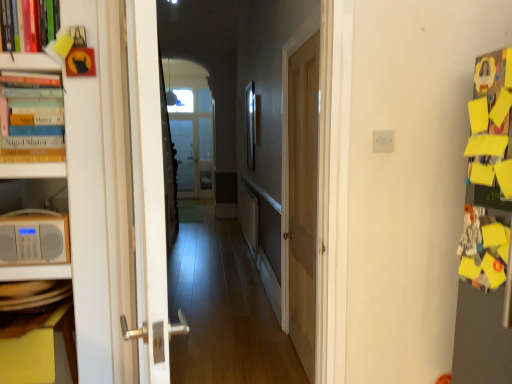
Question: Is hardcover books at left inside white plastic electric outlet at center?

Choices:
 (A) no
 (B) yes

Answer: (A)

Question: Considering the relative sizes of white plastic electric outlet at center and hardcover books at left in the image provided, is white plastic electric outlet at center wider than hardcover books at left?

Choices:
 (A) yes
 (B) no

Answer: (B)

Question: Would you consider white plastic electric outlet at center to be distant from hardcover books at left?

Choices:
 (A) no
 (B) yes

Answer: (B)

Question: Is white plastic electric outlet at center located outside hardcover books at left?

Choices:
 (A) yes
 (B) no

Answer: (A)

Question: Is white plastic electric outlet at center looking in the opposite direction of hardcover books at left?

Choices:
 (A) no
 (B) yes

Answer: (A)

Question: From a real-world perspective, is metallic silver picture frame at center above or below matte white radio at left?

Choices:
 (A) above
 (B) below

Answer: (A)

Question: In the image, is metallic silver picture frame at center positioned in front of or behind matte white radio at left?

Choices:
 (A) front
 (B) behind

Answer: (B)

Question: Looking at the image, does metallic silver picture frame at center seem bigger or smaller compared to matte white radio at left?

Choices:
 (A) big
 (B) small

Answer: (A)

Question: Is metallic silver picture frame at center taller or shorter than matte white radio at left?

Choices:
 (A) tall
 (B) short

Answer: (A)

Question: From a real-world perspective, relative to matte white radio at left, is white glossy door at left, the 1th door from the left, vertically above or below?

Choices:
 (A) above
 (B) below

Answer: (A)

Question: In terms of height, does white glossy door at left, marked as the second door in a right-to-left arrangement, look taller or shorter compared to matte white radio at left?

Choices:
 (A) tall
 (B) short

Answer: (A)

Question: Relative to matte white radio at left, is white glossy door at left, acting as the 1th door starting from the front, in front or behind?

Choices:
 (A) behind
 (B) front

Answer: (B)

Question: Considering the positions of white glossy door at left, acting as the 1th door starting from the front, and matte white radio at left in the image, is white glossy door at left, acting as the 1th door starting from the front, wider or thinner than matte white radio at left?

Choices:
 (A) wide
 (B) thin

Answer: (A)

Question: From the image's perspective, relative to wooden door at center, the second door positioned from the left, is wooden floor at center above or below?

Choices:
 (A) below
 (B) above

Answer: (B)

Question: From a real-world perspective, is wooden floor at center positioned above or below wooden door at center, the second door positioned from the left?

Choices:
 (A) below
 (B) above

Answer: (B)